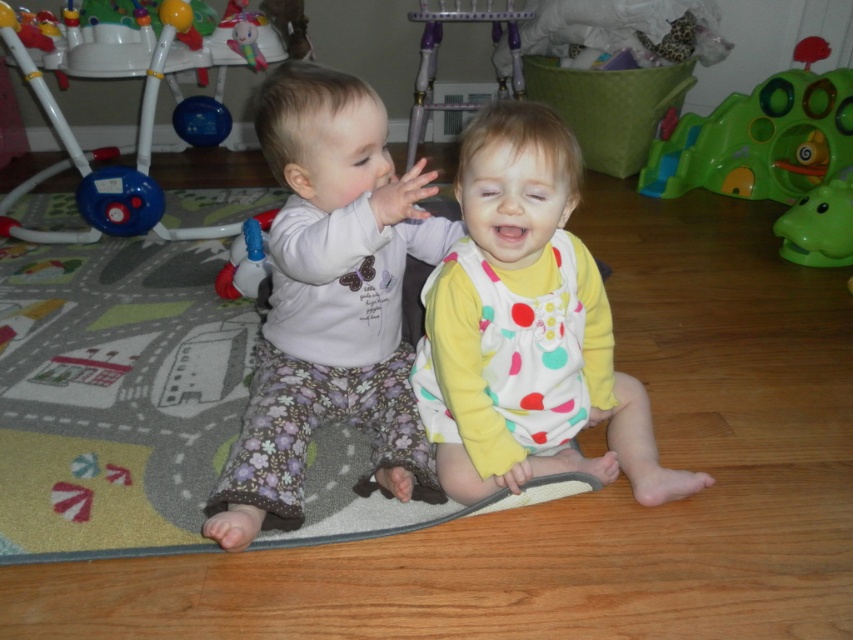
Does floral cotton pants at center have a greater height compared to transparent plastic spray bottle at left?

Yes, floral cotton pants at center is taller than transparent plastic spray bottle at left.

Is floral cotton pants at center closer to camera compared to transparent plastic spray bottle at left?

Yes.

Is point (294, 308) closer to viewer compared to point (256, 266)?

Yes.

In order to click on floral cotton pants at center in this screenshot , I will do `click(329, 298)`.

Based on the photo, does green plastic play structure at right have a greater height compared to white plastic walker at left?

No, green plastic play structure at right is not taller than white plastic walker at left.

The height and width of the screenshot is (640, 853). Describe the element at coordinates (772, 154) in the screenshot. I see `green plastic play structure at right` at that location.

Describe the element at coordinates (772, 154) in the screenshot. I see `green plastic play structure at right` at that location.

Locate an element on the screen. Image resolution: width=853 pixels, height=640 pixels. green plastic play structure at right is located at coordinates (772, 154).

Is polka dot fabric dress at center to the left of green plastic play structure at right from the viewer's perspective?

Yes, polka dot fabric dress at center is to the left of green plastic play structure at right.

Consider the image. Does polka dot fabric dress at center have a larger size compared to green plastic play structure at right?

No, polka dot fabric dress at center is not bigger than green plastic play structure at right.

Does point (488, 301) come closer to viewer compared to point (810, 104)?

Yes, it is in front of point (810, 104).

The height and width of the screenshot is (640, 853). I want to click on polka dot fabric dress at center, so click(526, 326).